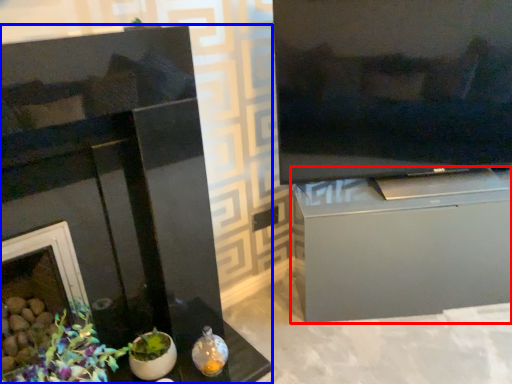
Question: Which point is closer to the camera, cabinetry (highlighted by a red box) or fireplace (highlighted by a blue box)?

Choices:
 (A) cabinetry
 (B) fireplace

Answer: (B)